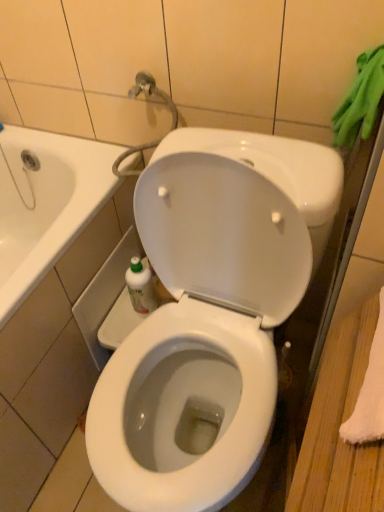
Question: Should I look upward or downward to see translucent plastic bottle at lower left?

Choices:
 (A) up
 (B) down

Answer: (B)

Question: From the image's perspective, is white glossy toilet at center over translucent plastic bottle at lower left?

Choices:
 (A) no
 (B) yes

Answer: (A)

Question: Considering the relative sizes of white glossy toilet at center and translucent plastic bottle at lower left in the image provided, is white glossy toilet at center shorter than translucent plastic bottle at lower left?

Choices:
 (A) no
 (B) yes

Answer: (A)

Question: Could you tell me if white glossy toilet at center is facing translucent plastic bottle at lower left?

Choices:
 (A) no
 (B) yes

Answer: (A)

Question: From a real-world perspective, is white glossy toilet at center on top of translucent plastic bottle at lower left?

Choices:
 (A) yes
 (B) no

Answer: (A)

Question: Is white glossy toilet at center oriented away from translucent plastic bottle at lower left?

Choices:
 (A) yes
 (B) no

Answer: (B)

Question: From the image's perspective, is white glossy toilet at center under translucent plastic bottle at lower left?

Choices:
 (A) no
 (B) yes

Answer: (B)

Question: Does translucent plastic bottle at lower left have a greater height compared to white glossy toilet at center?

Choices:
 (A) no
 (B) yes

Answer: (A)

Question: Is translucent plastic bottle at lower left positioned beyond the bounds of white glossy toilet at center?

Choices:
 (A) no
 (B) yes

Answer: (B)

Question: Is translucent plastic bottle at lower left not near white glossy toilet at center?

Choices:
 (A) yes
 (B) no

Answer: (B)

Question: Is translucent plastic bottle at lower left positioned in front of white glossy toilet at center?

Choices:
 (A) no
 (B) yes

Answer: (A)

Question: Is translucent plastic bottle at lower left looking in the opposite direction of white glossy toilet at center?

Choices:
 (A) no
 (B) yes

Answer: (A)

Question: From a real-world perspective, is translucent plastic bottle at lower left positioned over white glossy toilet at center based on gravity?

Choices:
 (A) yes
 (B) no

Answer: (B)

Question: From the image's perspective, does translucent plastic bottle at lower left appear higher than green rubber gloves at upper right?

Choices:
 (A) yes
 (B) no

Answer: (B)